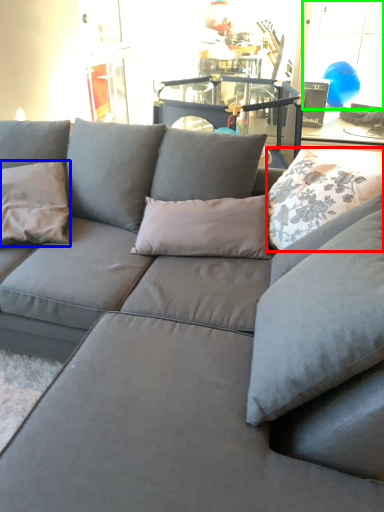
Question: Estimate the real-world distances between objects in this image. Which object is farther from pillow (highlighted by a red box), pillow (highlighted by a blue box) or window (highlighted by a green box)?

Choices:
 (A) pillow
 (B) window

Answer: (B)